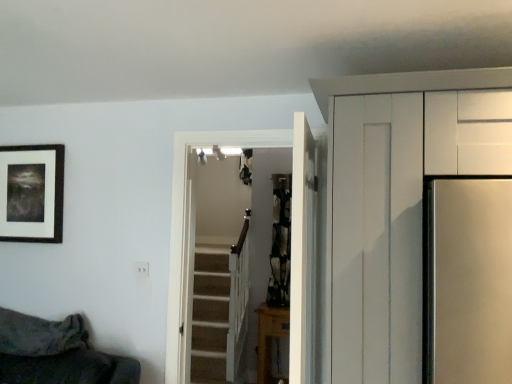
Question: Are wooden table at lower center and white wooden door at center, acting as the first door starting from the back, located far from each other?

Choices:
 (A) yes
 (B) no

Answer: (A)

Question: Does wooden table at lower center have a greater width compared to white wooden door at center, the second door from the front?

Choices:
 (A) no
 (B) yes

Answer: (B)

Question: Is wooden table at lower center further to the viewer compared to white wooden door at center, acting as the first door starting from the back?

Choices:
 (A) yes
 (B) no

Answer: (A)

Question: Is wooden table at lower center positioned with its back to white wooden door at center, acting as the first door starting from the back?

Choices:
 (A) yes
 (B) no

Answer: (B)

Question: Is wooden table at lower center at the left side of white wooden door at center, the second door from the front?

Choices:
 (A) no
 (B) yes

Answer: (A)

Question: From the image's perspective, is wooden table at lower center on white wooden door at center, acting as the first door starting from the back?

Choices:
 (A) no
 (B) yes

Answer: (A)

Question: Could you tell me if white wooden door at center, the 1th door viewed from the front, is turned towards white wooden door at center, the second door from the front?

Choices:
 (A) no
 (B) yes

Answer: (A)

Question: From a real-world perspective, is white wooden door at center, the 1th door viewed from the front, positioned over white wooden door at center, acting as the first door starting from the back, based on gravity?

Choices:
 (A) no
 (B) yes

Answer: (B)

Question: Does white wooden door at center, the second door when ordered from back to front, have a larger size compared to white wooden door at center, acting as the first door starting from the back?

Choices:
 (A) yes
 (B) no

Answer: (B)

Question: Can you confirm if white wooden door at center, the 1th door viewed from the front, is taller than white wooden door at center, the second door from the front?

Choices:
 (A) no
 (B) yes

Answer: (A)

Question: Does white wooden door at center, the second door when ordered from back to front, have a lesser width compared to white wooden door at center, the second door from the front?

Choices:
 (A) yes
 (B) no

Answer: (A)

Question: Considering the relative positions of white wooden door at center, the 1th door viewed from the front, and white wooden door at center, acting as the first door starting from the back, in the image provided, is white wooden door at center, the 1th door viewed from the front, to the right of white wooden door at center, acting as the first door starting from the back, from the viewer's perspective?

Choices:
 (A) no
 (B) yes

Answer: (B)

Question: Is black matte picture frame at upper left thinner than wooden table at lower center?

Choices:
 (A) no
 (B) yes

Answer: (B)